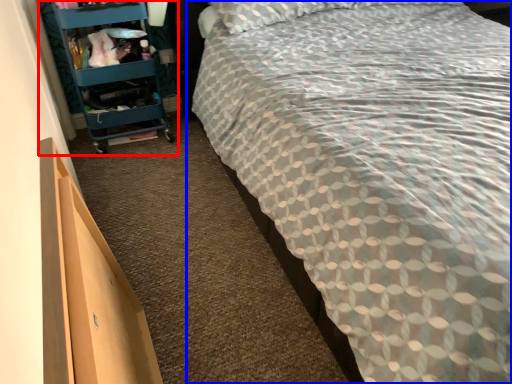
Question: Which of the following is the farthest to the observer, furniture (highlighted by a red box) or bed (highlighted by a blue box)?

Choices:
 (A) furniture
 (B) bed

Answer: (A)